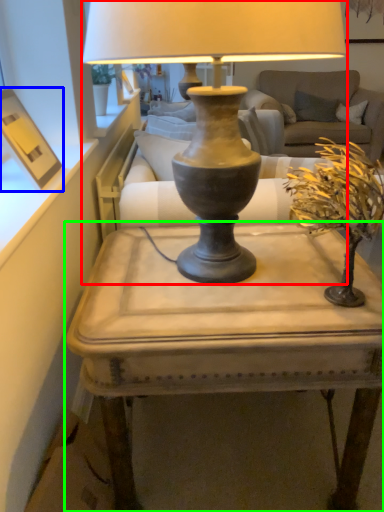
Question: Considering the real-world distances, which object is farthest from lamp (highlighted by a red box)? picture frame (highlighted by a blue box) or table (highlighted by a green box)?

Choices:
 (A) picture frame
 (B) table

Answer: (A)